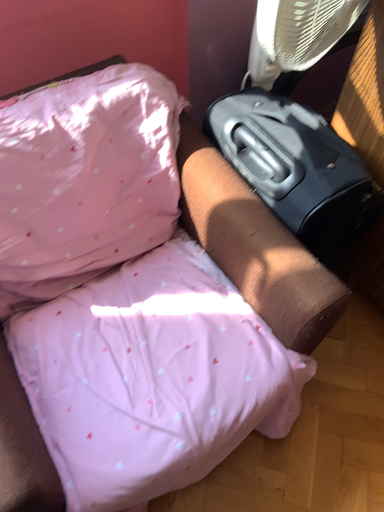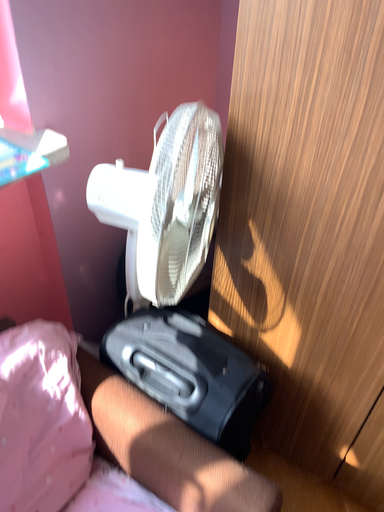
Question: Which way did the camera rotate in the video?

Choices:
 (A) rotated right
 (B) rotated left

Answer: (A)